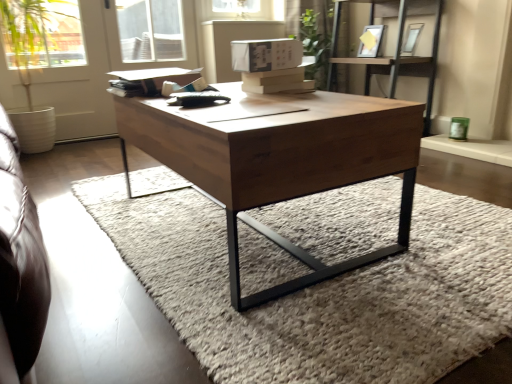
Find the location of a particular element. free spot in front of wooden coffee table at center is located at coordinates (298, 314).